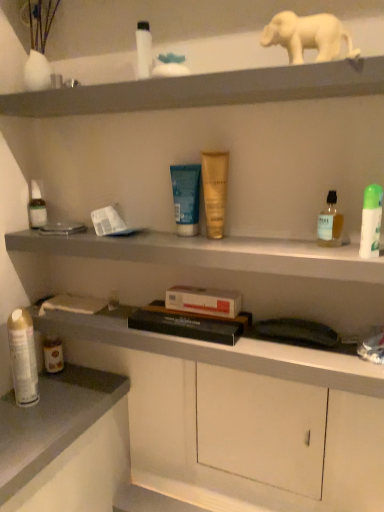
Identify the location of spots to the right of metallic silver spray can at lower left, the 2th toiletry viewed from the back. (74, 402).